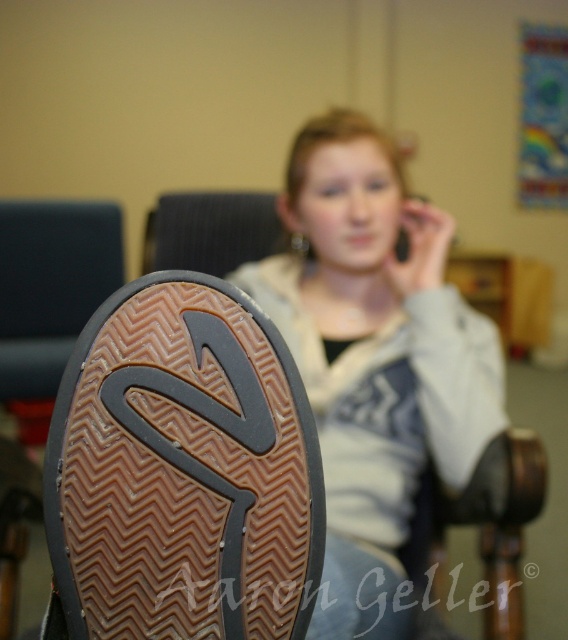
Which is behind, point (237, 563) or point (311, 237)?

The point (311, 237) is more distant.

Between brown rubber shoe at lower left and matte gray hoodie at center, which one is positioned lower?

Positioned lower is brown rubber shoe at lower left.

Find the location of a particular element. The height and width of the screenshot is (640, 568). brown rubber shoe at lower left is located at coordinates (183, 470).